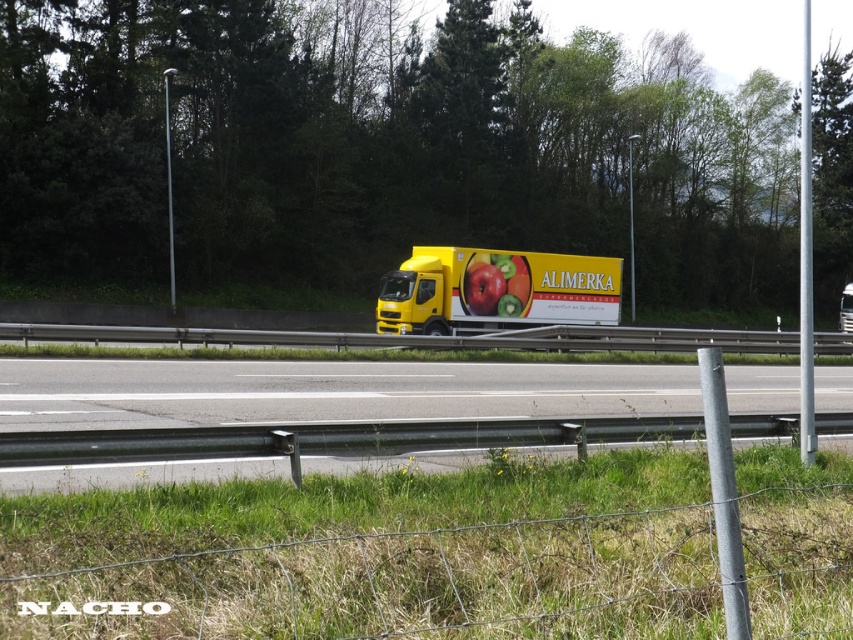
Question: Which object is closer to the camera taking this photo?

Choices:
 (A) yellow matte trailer truck at center
 (B) yellow matte truck at center
 (C) shiny red apple at center

Answer: (B)

Question: Which is farther from the shiny red apple at center?

Choices:
 (A) yellow matte trailer truck at center
 (B) yellow matte truck at center

Answer: (B)

Question: Which point is closer to the camera taking this photo?

Choices:
 (A) (62, 417)
 (B) (476, 285)
 (C) (596, 285)

Answer: (A)

Question: Can you confirm if yellow matte trailer truck at center is thinner than shiny red apple at center?

Choices:
 (A) yes
 (B) no

Answer: (B)

Question: Is yellow matte truck at center wider than yellow matte trailer truck at center?

Choices:
 (A) no
 (B) yes

Answer: (B)

Question: Does yellow matte trailer truck at center appear under shiny red apple at center?

Choices:
 (A) no
 (B) yes

Answer: (B)